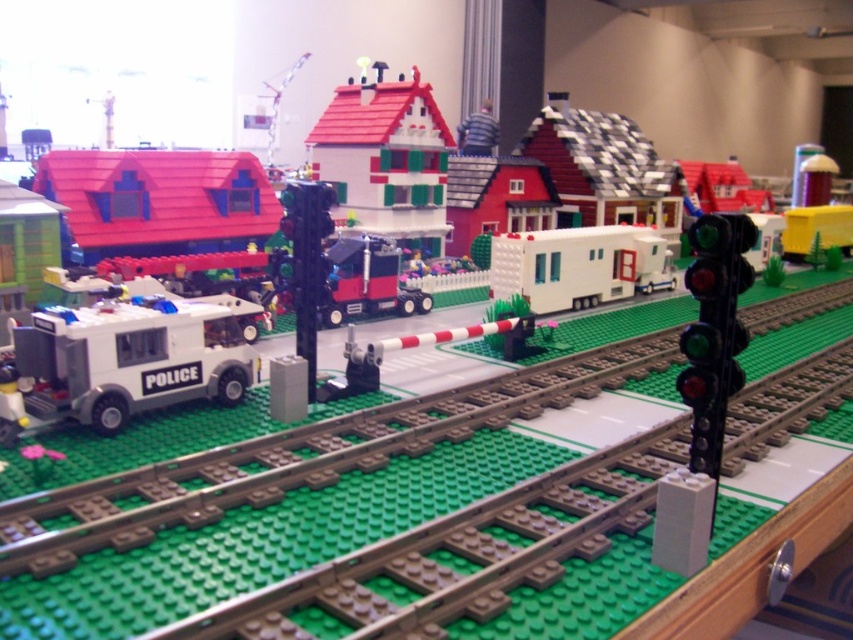
Question: Which object is positioned farthest from the matte plastic house at upper left?

Choices:
 (A) white matte trailer at center
 (B) smooth white house at center
 (C) white matte police car at left
 (D) brown textured train track at center

Answer: (D)

Question: Which point is closer to the camera?

Choices:
 (A) (621, 250)
 (B) (419, 208)

Answer: (A)

Question: Among these objects, which one is nearest to the camera?

Choices:
 (A) matte plastic house at upper left
 (B) smooth white house at center
 (C) brown textured train track at center

Answer: (C)

Question: Is brown textured train track at center wider than white matte police car at left?

Choices:
 (A) yes
 (B) no

Answer: (A)

Question: Does brown textured train track at center have a greater width compared to white matte trailer at center?

Choices:
 (A) no
 (B) yes

Answer: (B)

Question: Can you confirm if smooth white house at center is positioned to the right of white matte trailer at center?

Choices:
 (A) yes
 (B) no

Answer: (B)